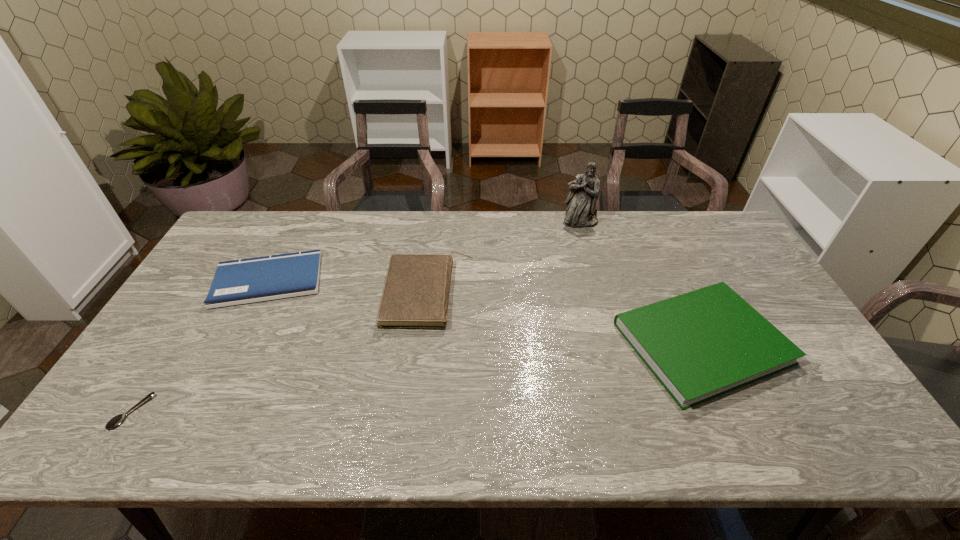
Find the location of `free space located 0.230m on the back of the leftmost paperback book`. free space located 0.230m on the back of the leftmost paperback book is located at coordinates (301, 214).

Where is `vacant space situated on the back of the soupspoon`? The width and height of the screenshot is (960, 540). vacant space situated on the back of the soupspoon is located at coordinates (210, 289).

This screenshot has height=540, width=960. What are the coordinates of `object that is at the far edge` in the screenshot? It's located at (584, 190).

Where is `object that is at the near edge`? object that is at the near edge is located at coordinates (115, 421).

At what (x,y) coordinates should I click in order to perform the action: click on paperback book present at the left edge. Please return your answer as a coordinate pair (x, y). The width and height of the screenshot is (960, 540). Looking at the image, I should click on (242, 281).

Locate an element on the screen. The width and height of the screenshot is (960, 540). soupspoon present at the left edge is located at coordinates (115, 421).

The width and height of the screenshot is (960, 540). Find the location of `object at the right edge`. object at the right edge is located at coordinates 702,344.

You are a GUI agent. You are given a task and a screenshot of the screen. Output one action in this format:
    pyautogui.click(x=<x>, y=<y>)
    Task: Click on the object located at the near left corner
    
    Given the screenshot: What is the action you would take?
    pyautogui.click(x=115, y=421)

You are a GUI agent. You are given a task and a screenshot of the screen. Output one action in this format:
    pyautogui.click(x=<x>, y=<y>)
    Task: Click on the blank space at the far edge
    The width and height of the screenshot is (960, 540).
    Given the screenshot: What is the action you would take?
    pyautogui.click(x=399, y=247)

You are a GUI agent. You are given a task and a screenshot of the screen. Output one action in this format:
    pyautogui.click(x=<x>, y=<y>)
    Task: Click on the vacant region at the right edge
    The width and height of the screenshot is (960, 540).
    Given the screenshot: What is the action you would take?
    pyautogui.click(x=843, y=405)